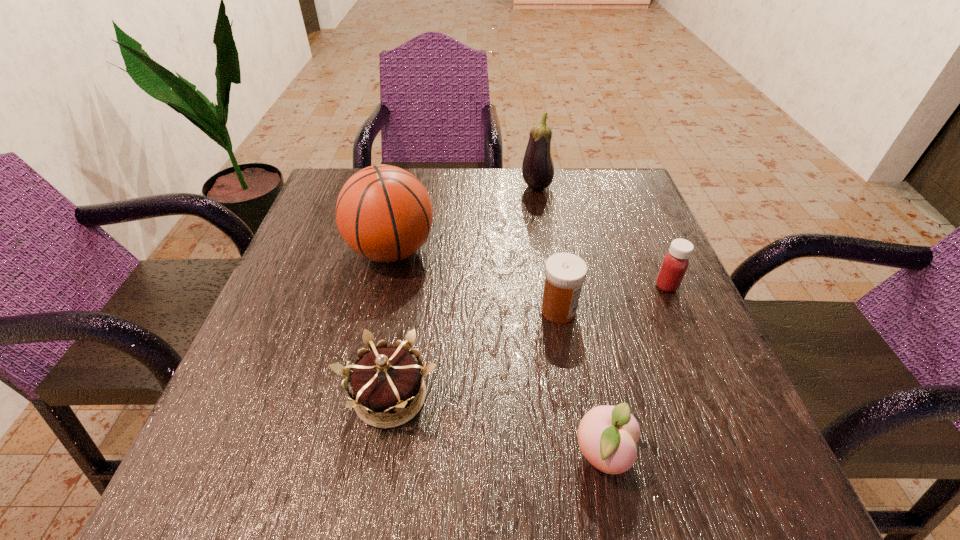
Identify the location of vacant space at the near edge of the desktop. (383, 491).

What are the coordinates of `vacant space at the left edge of the desktop` in the screenshot? It's located at (354, 261).

Locate an element on the screen. This screenshot has height=540, width=960. vacant space at the right edge of the desktop is located at coordinates (688, 424).

Find the location of `free location at the far left corner`. free location at the far left corner is located at coordinates (343, 170).

Identify the location of vacant space at the near left corner of the desktop. The height and width of the screenshot is (540, 960). (197, 454).

I want to click on vacant space at the far right corner of the desktop, so click(x=608, y=204).

Identify the location of free region at the near right corner of the desktop. (667, 466).

Find the location of a particular element. Image resolution: width=960 pixels, height=540 pixels. vacant space in between the crown and the peach is located at coordinates (496, 426).

I want to click on empty space that is in between the left medicine and the peach, so click(581, 383).

Locate an element on the screen. Image resolution: width=960 pixels, height=540 pixels. unoccupied position between the crown and the peach is located at coordinates (496, 426).